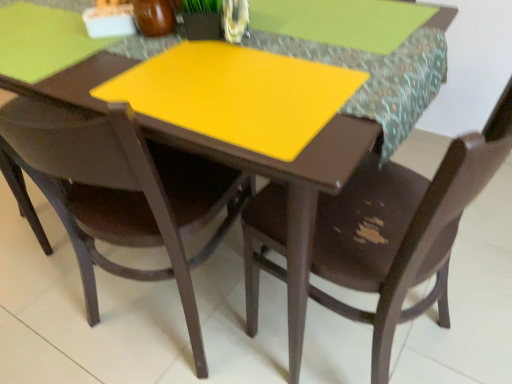
Locate an element on the screen. yellow matte placemat at center is located at coordinates (377, 77).

In the scene shown: From a real-world perspective, is yellow matte placemat at center under matte brown chair at center, the second chair viewed from the right?

No, from a real-world perspective, yellow matte placemat at center is not beneath matte brown chair at center, the second chair viewed from the right.

Between point (377, 120) and point (194, 320), which one is positioned in front?

The point (377, 120) is more forward.

What are the coordinates of `chair on the left side of yellow matte placemat at center` in the screenshot? It's located at (122, 193).

Between brown matte chair at center, which is counted as the first chair, starting from the right, and yellow matte placemat at center, which one has smaller width?

With smaller width is yellow matte placemat at center.

Is brown matte chair at center, acting as the 2th chair starting from the left, looking in the opposite direction of yellow matte placemat at center?

No.

Which object is closer to the camera taking this photo, brown matte chair at center, which is counted as the first chair, starting from the right, or yellow matte placemat at center?

brown matte chair at center, which is counted as the first chair, starting from the right, is more forward.

Which object is positioned more to the left, matte brown chair at center, arranged as the first chair when viewed from the left, or brown matte chair at center, which is counted as the first chair, starting from the right?

matte brown chair at center, arranged as the first chair when viewed from the left, is more to the left.

Which of these two, matte brown chair at center, arranged as the first chair when viewed from the left, or brown matte chair at center, acting as the 2th chair starting from the left, is smaller?

Smaller between the two is matte brown chair at center, arranged as the first chair when viewed from the left.

Which is behind, point (104, 239) or point (387, 284)?

Positioned behind is point (104, 239).

Which object is wider, matte brown chair at center, arranged as the first chair when viewed from the left, or brown matte chair at center, acting as the 2th chair starting from the left?

matte brown chair at center, arranged as the first chair when viewed from the left, is wider.

How many degrees apart are the facing directions of yellow matte placemat at center and brown matte chair at center, which is counted as the first chair, starting from the right?

The facing directions of yellow matte placemat at center and brown matte chair at center, which is counted as the first chair, starting from the right, are 96.3 degrees apart.

From the image's perspective, is yellow matte placemat at center over brown matte chair at center, acting as the 2th chair starting from the left?

Yes, from the image's perspective, yellow matte placemat at center is on top of brown matte chair at center, acting as the 2th chair starting from the left.

How distant is yellow matte placemat at center from brown matte chair at center, acting as the 2th chair starting from the left?

A distance of 9.44 inches exists between yellow matte placemat at center and brown matte chair at center, acting as the 2th chair starting from the left.

Starting from the yellow matte placemat at center, which chair is the 2nd one in front? Please provide its 2D coordinates.

[(401, 230)]

Which object is positioned more to the left, matte brown chair at center, the second chair viewed from the right, or yellow matte placemat at center?

From the viewer's perspective, matte brown chair at center, the second chair viewed from the right, appears more on the left side.

From the image's perspective, is matte brown chair at center, the second chair viewed from the right, beneath yellow matte placemat at center?

Yes, from the image's perspective, matte brown chair at center, the second chair viewed from the right, is below yellow matte placemat at center.

Which is correct: matte brown chair at center, arranged as the first chair when viewed from the left, is inside yellow matte placemat at center, or outside of it?

matte brown chair at center, arranged as the first chair when viewed from the left, is not inside yellow matte placemat at center, it's outside.

Does matte brown chair at center, the second chair viewed from the right, have a lesser width compared to yellow matte placemat at center?

In fact, matte brown chair at center, the second chair viewed from the right, might be wider than yellow matte placemat at center.

Can you confirm if brown matte chair at center, acting as the 2th chair starting from the left, is positioned to the left of matte brown chair at center, arranged as the first chair when viewed from the left?

No.

Is point (498, 145) closer to viewer compared to point (230, 192)?

Yes, point (498, 145) is in front of point (230, 192).

Based on the photo, is brown matte chair at center, acting as the 2th chair starting from the left, bigger than matte brown chair at center, the second chair viewed from the right?

Yes, brown matte chair at center, acting as the 2th chair starting from the left, is bigger than matte brown chair at center, the second chair viewed from the right.

The width and height of the screenshot is (512, 384). Identify the location of counter top lying behind the matte brown chair at center, the second chair viewed from the right. (377, 77).

Identify the location of counter top to the left of brown matte chair at center, acting as the 2th chair starting from the left. (377, 77).

Based on the photo, which object lies nearer to the anchor point matte brown chair at center, the second chair viewed from the right, yellow matte placemat at center or brown matte chair at center, acting as the 2th chair starting from the left?

brown matte chair at center, acting as the 2th chair starting from the left, is positioned closer to the anchor matte brown chair at center, the second chair viewed from the right.

Considering their positions, is matte brown chair at center, the second chair viewed from the right, positioned further to yellow matte placemat at center than brown matte chair at center, which is counted as the first chair, starting from the right?

Based on the image, matte brown chair at center, the second chair viewed from the right, appears to be further to yellow matte placemat at center.

Looking at the image, which one is located closer to matte brown chair at center, the second chair viewed from the right, brown matte chair at center, which is counted as the first chair, starting from the right, or yellow matte placemat at center?

brown matte chair at center, which is counted as the first chair, starting from the right, is closer to matte brown chair at center, the second chair viewed from the right.

Looking at this image, considering their positions, is matte brown chair at center, arranged as the first chair when viewed from the left, positioned closer to brown matte chair at center, which is counted as the first chair, starting from the right, than yellow matte placemat at center?

yellow matte placemat at center lies closer to brown matte chair at center, which is counted as the first chair, starting from the right, than the other object.

Which object lies nearer to the anchor point brown matte chair at center, acting as the 2th chair starting from the left, yellow matte placemat at center or matte brown chair at center, arranged as the first chair when viewed from the left?

Among the two, yellow matte placemat at center is located nearer to brown matte chair at center, acting as the 2th chair starting from the left.

When comparing their distances from yellow matte placemat at center, does brown matte chair at center, which is counted as the first chair, starting from the right, or matte brown chair at center, the second chair viewed from the right, seem closer?

Based on the image, brown matte chair at center, which is counted as the first chair, starting from the right, appears to be nearer to yellow matte placemat at center.

At what (x,y) coordinates should I click in order to perform the action: click on counter top between matte brown chair at center, arranged as the first chair when viewed from the left, and brown matte chair at center, acting as the 2th chair starting from the left, in the horizontal direction. Please return your answer as a coordinate pair (x, y). The image size is (512, 384). Looking at the image, I should click on (377, 77).